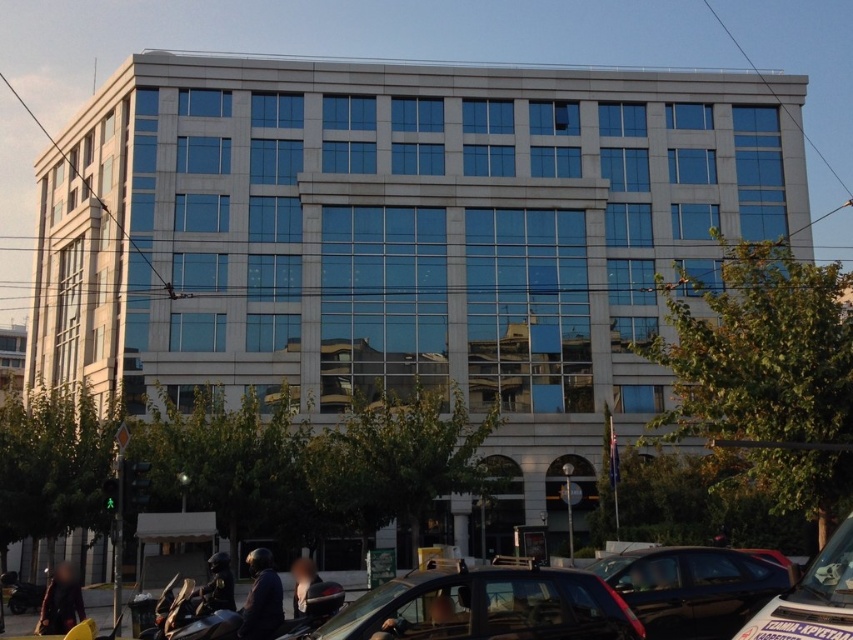
You are a delivery person approaching the building and need to park your shiny black helmet at lower center near the matte black car at center. Can you place the helmet directly in front of the car?

The matte black car at center is to the right of the shiny black helmet at lower center, so the helmet is already positioned to the left of the car. Therefore, you can place the helmet directly in front of the matte black car at center as it is already aligned to the left side.

From the picture: You are a delivery person arriving at the building and need to park your vehicle. You see a matte black car at center and a glossy black car at lower right. Which car is closer to the entrance of the building?

The matte black car at center is positioned on the left side of the glossy black car at lower right, so the glossy black car at lower right is closer to the entrance of the building.